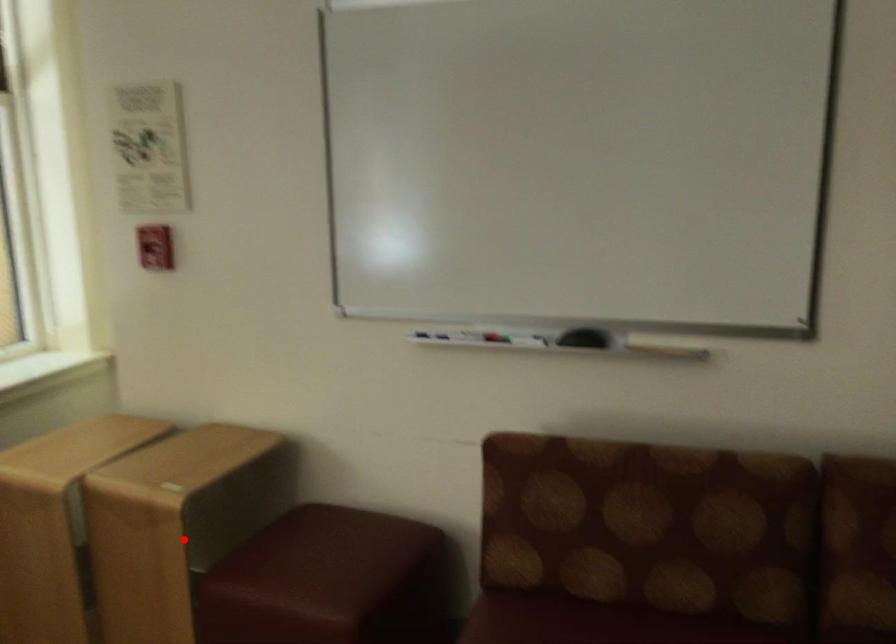
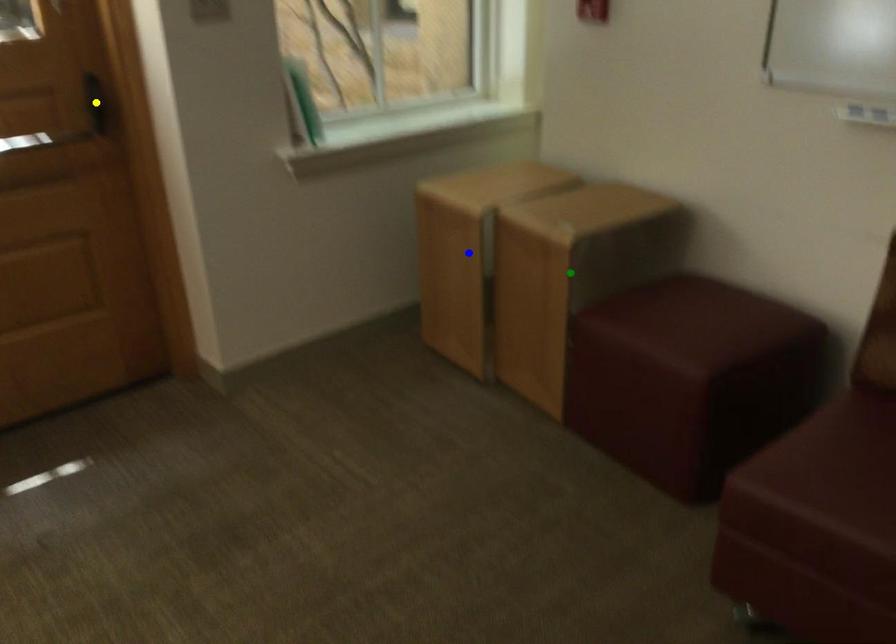
Question: I am providing you with two images of the same scene from different viewpoints. A red point is marked on the first image. You are given multiple points on the second image. In image 2, which mark is for the same physical point as the one in image 1?

Choices:
 (A) blue point
 (B) green point
 (C) yellow point

Answer: (B)